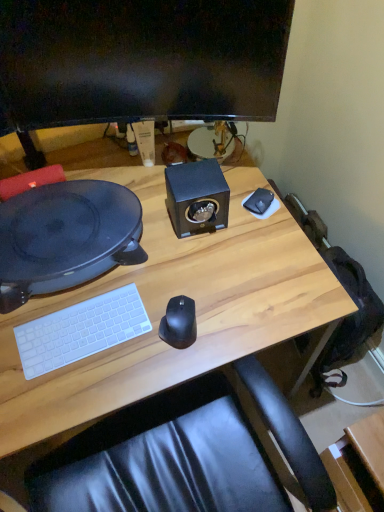
What are the coordinates of `unoccupied area in front of white matte mousepad at upper right` in the screenshot? It's located at (260, 247).